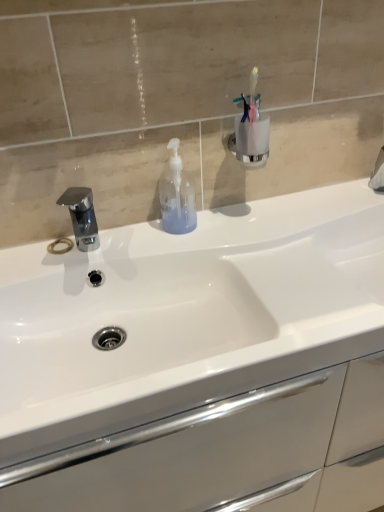
Question: Should I look upward or downward to see translucent plastic soap dispenser at center?

Choices:
 (A) up
 (B) down

Answer: (A)

Question: Can you confirm if translucent plastic soap dispenser at center is bigger than chrome metallic faucet at left?

Choices:
 (A) yes
 (B) no

Answer: (B)

Question: Does translucent plastic soap dispenser at center have a smaller size compared to chrome metallic faucet at left?

Choices:
 (A) yes
 (B) no

Answer: (A)

Question: Does translucent plastic soap dispenser at center come in front of chrome metallic faucet at left?

Choices:
 (A) no
 (B) yes

Answer: (A)

Question: Can you confirm if translucent plastic soap dispenser at center is thinner than chrome metallic faucet at left?

Choices:
 (A) yes
 (B) no

Answer: (A)

Question: Is translucent plastic soap dispenser at center directly adjacent to chrome metallic faucet at left?

Choices:
 (A) no
 (B) yes

Answer: (A)

Question: Considering the relative sizes of translucent plastic soap dispenser at center and chrome metallic faucet at left in the image provided, is translucent plastic soap dispenser at center wider than chrome metallic faucet at left?

Choices:
 (A) yes
 (B) no

Answer: (B)

Question: Is white glossy sink at center oriented towards chrome metallic faucet at left?

Choices:
 (A) yes
 (B) no

Answer: (B)

Question: Is white glossy sink at center shorter than chrome metallic faucet at left?

Choices:
 (A) no
 (B) yes

Answer: (A)

Question: Can you confirm if white glossy sink at center is bigger than chrome metallic faucet at left?

Choices:
 (A) no
 (B) yes

Answer: (B)

Question: Does white glossy sink at center lie behind chrome metallic faucet at left?

Choices:
 (A) no
 (B) yes

Answer: (A)

Question: Are white glossy sink at center and chrome metallic faucet at left far apart?

Choices:
 (A) yes
 (B) no

Answer: (B)

Question: Is white glossy sink at center to the left of chrome metallic faucet at left from the viewer's perspective?

Choices:
 (A) yes
 (B) no

Answer: (B)

Question: Is white glossy sink at center located outside translucent plastic soap dispenser at center?

Choices:
 (A) no
 (B) yes

Answer: (B)